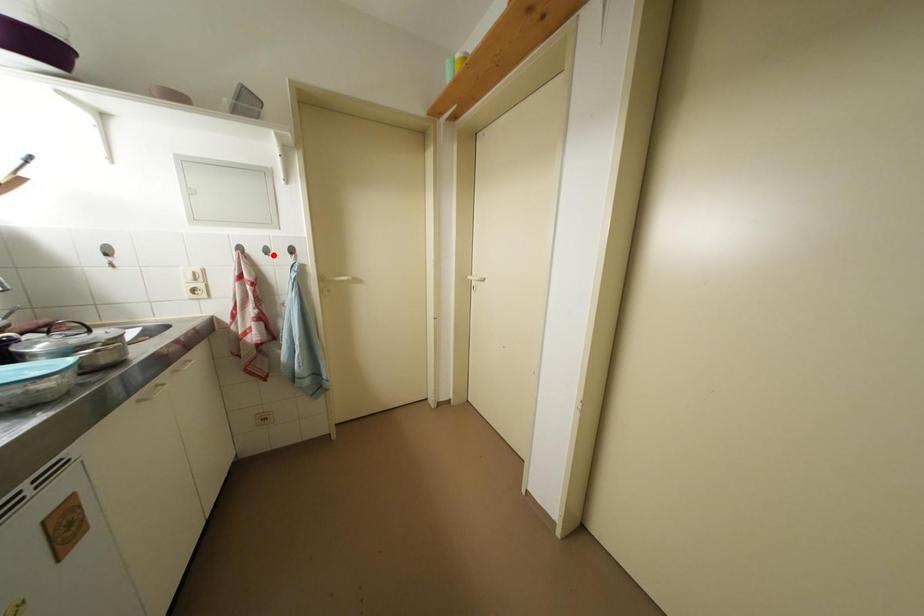
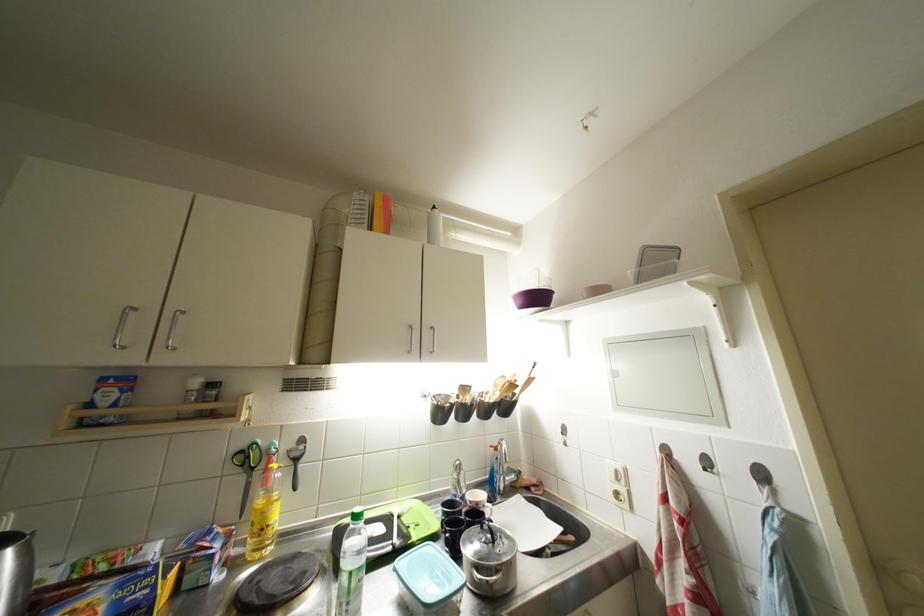
In the second image, find the point that corresponds to the highlighted location in the first image.

(714, 467)